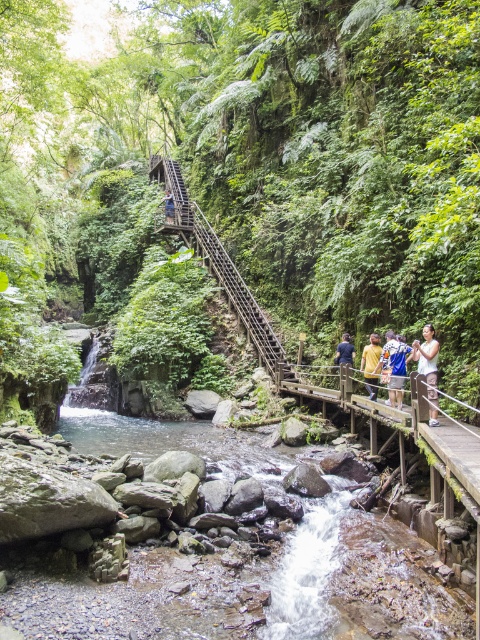
Looking at this image, you are a hiker carrying a 30kg backpack and want to cross the stream. The point you are standing on is point (190,13). The stream is 54.85 meters wide at this point. Can you safely cross the stream?

The stream is 54.85 meters wide at this point, so it is too wide to safely cross with a 30kg backpack. You should look for a narrower section or an alternative path.

You are a hiker carrying a 1.5 meter wide tent. You need to set up camp near the stream but want to ensure there is enough space. Based on the scene, can you determine if the green leafy forest at center has enough width to accommodate your tent compared to the wooden staircase at upper center?

The green leafy forest at center might be wider than wooden staircase at upper center, so there is a possibility that the forest area could provide sufficient space for your 1.5 meter wide tent. However, since the exact width isn